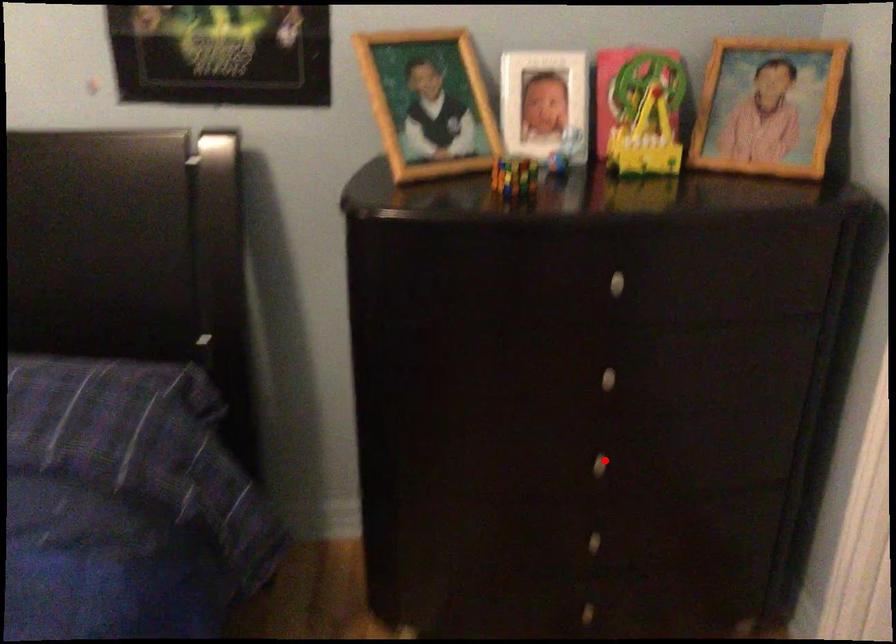
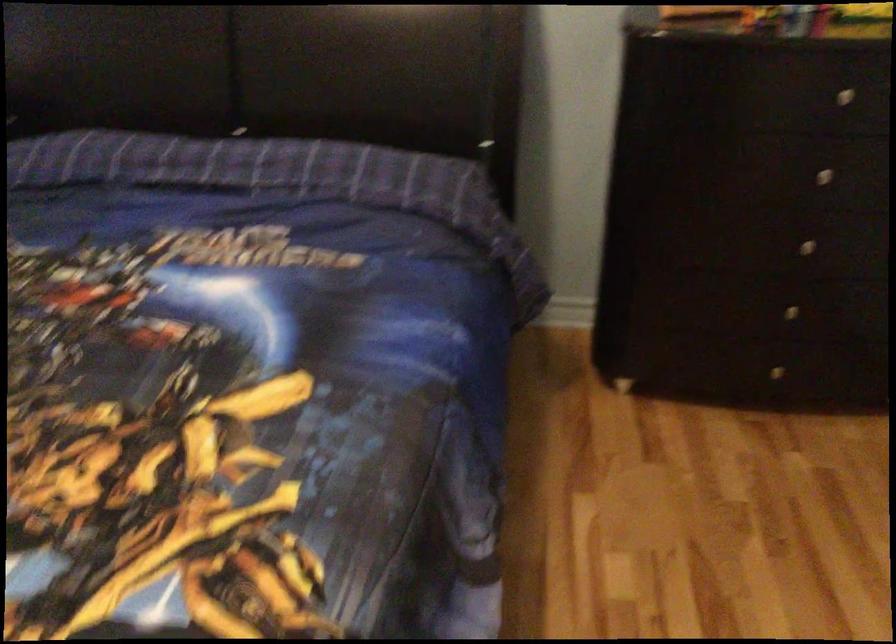
Question: I am providing you with two images of the same scene from different viewpoints. Given a red point in image1, look at the same physical point in image2. Is it:

Choices:
 (A) Closer to the viewpoint
 (B) Farther from the viewpoint

Answer: (B)